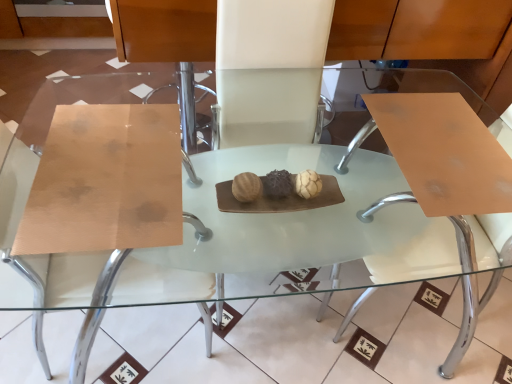
Question: Can you confirm if matte wood chair at center, which appears as the 2th chair when viewed from the right, is wider than matte brown swivel chair at right?

Choices:
 (A) yes
 (B) no

Answer: (A)

Question: Is matte wood chair at center, which appears as the 2th chair when viewed from the right, at the right side of matte brown swivel chair at right?

Choices:
 (A) no
 (B) yes

Answer: (A)

Question: Considering the relative sizes of matte wood chair at center, which appears as the 1th chair when viewed from the left, and matte brown swivel chair at right in the image provided, is matte wood chair at center, which appears as the 1th chair when viewed from the left, bigger than matte brown swivel chair at right?

Choices:
 (A) yes
 (B) no

Answer: (A)

Question: Is matte wood chair at center, which appears as the 2th chair when viewed from the right, positioned before matte brown swivel chair at right?

Choices:
 (A) yes
 (B) no

Answer: (A)

Question: Does matte wood chair at center, which appears as the 1th chair when viewed from the left, have a smaller size compared to matte brown swivel chair at right?

Choices:
 (A) yes
 (B) no

Answer: (B)

Question: In the image, is matte wood chair at center, which appears as the 2th chair when viewed from the right, on the left side or the right side of white leather chair at center, placed as the second chair when sorted from left to right?

Choices:
 (A) right
 (B) left

Answer: (B)

Question: Is matte wood chair at center, which appears as the 1th chair when viewed from the left, spatially inside white leather chair at center, which is the 1th chair in right-to-left order, or outside of it?

Choices:
 (A) outside
 (B) inside

Answer: (A)

Question: Considering their positions, is matte wood chair at center, which appears as the 2th chair when viewed from the right, located in front of or behind white leather chair at center, which is the 1th chair in right-to-left order?

Choices:
 (A) behind
 (B) front

Answer: (B)

Question: From a real-world perspective, is matte wood chair at center, which appears as the 2th chair when viewed from the right, above or below white leather chair at center, which is the 1th chair in right-to-left order?

Choices:
 (A) above
 (B) below

Answer: (B)

Question: Do you think white leather chair at center, placed as the second chair when sorted from left to right, is within matte wood chair at center, which appears as the 2th chair when viewed from the right, or outside of it?

Choices:
 (A) outside
 (B) inside

Answer: (A)

Question: In the image, is white leather chair at center, which is the 1th chair in right-to-left order, on the left side or the right side of matte wood chair at center, which appears as the 2th chair when viewed from the right?

Choices:
 (A) left
 (B) right

Answer: (B)

Question: From the image's perspective, is white leather chair at center, placed as the second chair when sorted from left to right, positioned above or below matte wood chair at center, which appears as the 2th chair when viewed from the right?

Choices:
 (A) above
 (B) below

Answer: (A)

Question: In terms of width, does white leather chair at center, placed as the second chair when sorted from left to right, look wider or thinner when compared to matte wood chair at center, which appears as the 1th chair when viewed from the left?

Choices:
 (A) wide
 (B) thin

Answer: (B)

Question: In terms of height, does matte wood chair at center, which appears as the 1th chair when viewed from the left, look taller or shorter compared to matte brown swivel chair at right?

Choices:
 (A) tall
 (B) short

Answer: (A)

Question: Is matte wood chair at center, which appears as the 1th chair when viewed from the left, inside or outside of matte brown swivel chair at right?

Choices:
 (A) inside
 (B) outside

Answer: (B)